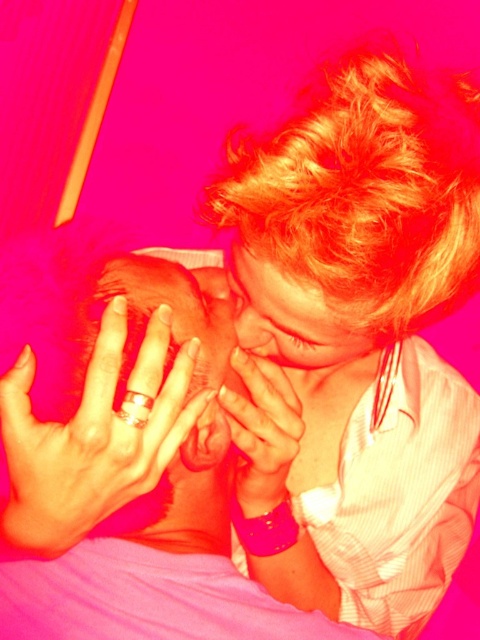
You are standing at the camera position and want to reach the point marked as point (294, 305). If your arm is 20 inches long, can you reach it without moving your feet?

The distance between point (294, 305) and the camera is 19.64 inches, so yes, you can reach it with your 20 inch arm without moving your feet.

You are a photographer trying to capture a closeup of the smooth skin baby at center. The camera you are using has a minimum focusing distance of 50 centimeters. Based on the scene description, will you be able to take the photo without moving closer?

The distance between the smooth skin baby at center and the camera is 47.23 centimeters, which is less than the camera minimum focusing distance of 50 centimeters. Therefore, you need to move back to ensure the camera can focus properly.